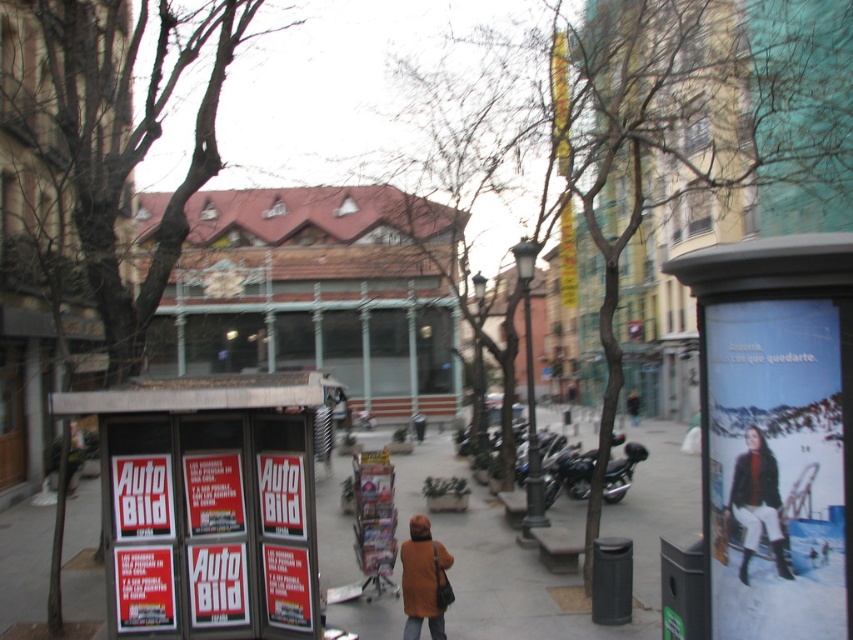
Question: In this image, where is red glossy magazine stand at center located relative to leather jacket at lower right?

Choices:
 (A) right
 (B) left

Answer: (B)

Question: Which object is closer to the camera taking this photo?

Choices:
 (A) dark brown leather jacket at lower right
 (B) brown wooden building at center

Answer: (A)

Question: Which object is the farthest from the orange woolen coat at lower center?

Choices:
 (A) brown wooden building at center
 (B) dark brown leather jacket at lower right
 (C) smooth concrete pavement at center
 (D) leather jacket at lower right

Answer: (A)

Question: Among these objects, which one is farthest from the camera?

Choices:
 (A) red glossy magazine stand at center
 (B) smooth concrete pavement at center
 (C) shiny black motorcycle at center
 (D) orange woolen coat at lower center

Answer: (C)

Question: Is red glossy magazine stand at center to the left of leather jacket at lower right from the viewer's perspective?

Choices:
 (A) yes
 (B) no

Answer: (A)

Question: Can you confirm if orange woolen coat at lower center is positioned to the right of shiny black motorcycle at center?

Choices:
 (A) no
 (B) yes

Answer: (A)